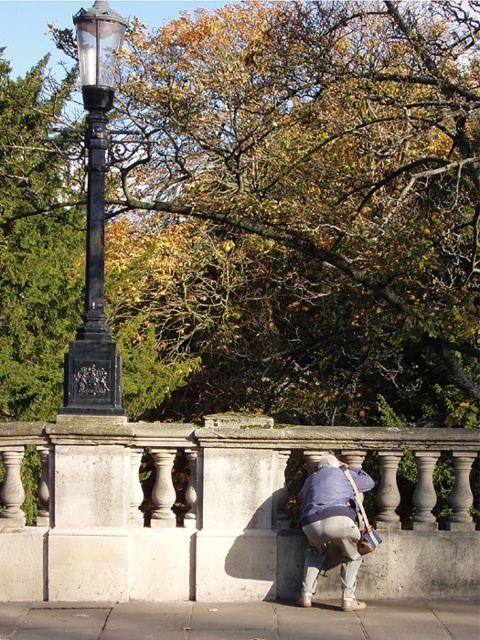
You are standing at the origin point of the image. You need to locate the white stone balustrade at center. Which direction should you move to reach it?

The white stone balustrade at center is located at point 0.798 on the x axis and 0.452 on the y axis. Since you are at the origin point, you should move towards the right and slightly upwards to reach it.

You are standing in a park and see the white stone balustrade at center and the black wrought iron lamp post at left. Which object is positioned to the right of the other?

The white stone balustrade at center is positioned to the right of the black wrought iron lamp post at left.

You are a hiker who has just arrived at the viewpoint. You see a green leafy tree at upper center and a light blue fabric at lower center. How far apart are these two objects from each other?

The green leafy tree at upper center is 11.06 meters from the light blue fabric at lower center.